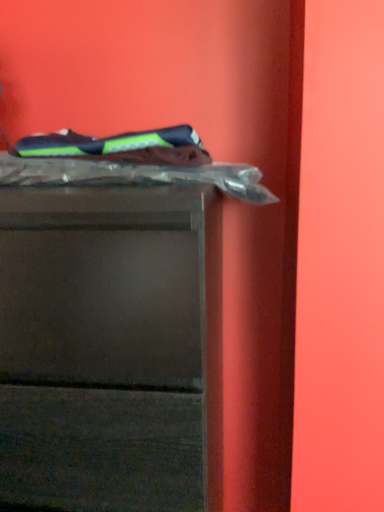
What do you see at coordinates (127, 162) in the screenshot? I see `clear plastic laundry at upper center, the 1th laundry from the bottom` at bounding box center [127, 162].

Measure the distance between matte plastic chest of drawers at upper left and camera.

They are 21.03 inches apart.

What are the coordinates of `clear plastic laundry at upper center, the 1th laundry from the bottom` in the screenshot? It's located at (127, 162).

From the image's perspective, between clear plastic laundry at upper center, the 1th laundry from the bottom, and dark blue fabric at upper left, the 2th laundry positioned from the bottom, which one is located above?

From the image's view, dark blue fabric at upper left, the 2th laundry positioned from the bottom, is above.

Considering the relative sizes of clear plastic laundry at upper center, the 1th laundry from the bottom, and dark blue fabric at upper left, which is the 1th laundry from top to bottom, in the image provided, is clear plastic laundry at upper center, the 1th laundry from the bottom, thinner than dark blue fabric at upper left, which is the 1th laundry from top to bottom,?

In fact, clear plastic laundry at upper center, the 1th laundry from the bottom, might be wider than dark blue fabric at upper left, which is the 1th laundry from top to bottom.

In the image, is clear plastic laundry at upper center, the 2th laundry from the top, on the left side or the right side of dark blue fabric at upper left, which is the 1th laundry from top to bottom?

clear plastic laundry at upper center, the 2th laundry from the top, is positioned on dark blue fabric at upper left, which is the 1th laundry from top to bottom,'s right side.

Would you consider clear plastic laundry at upper center, the 2th laundry from the top, to be distant from dark blue fabric at upper left, the 2th laundry positioned from the bottom?

No, clear plastic laundry at upper center, the 2th laundry from the top, is not far away from dark blue fabric at upper left, the 2th laundry positioned from the bottom.

From the image's perspective, does clear plastic laundry at upper center, the 2th laundry from the top, appear higher than matte plastic chest of drawers at upper left?

Yes, from the image's perspective, clear plastic laundry at upper center, the 2th laundry from the top, is above matte plastic chest of drawers at upper left.

Is clear plastic laundry at upper center, the 2th laundry from the top, at the left side of matte plastic chest of drawers at upper left?

In fact, clear plastic laundry at upper center, the 2th laundry from the top, is to the right of matte plastic chest of drawers at upper left.

The image size is (384, 512). Find the location of `the 2nd laundry to the right of the matte plastic chest of drawers at upper left, counting from the anchor's position`. the 2nd laundry to the right of the matte plastic chest of drawers at upper left, counting from the anchor's position is located at coordinates (127, 162).

Can you confirm if clear plastic laundry at upper center, the 2th laundry from the top, is taller than matte plastic chest of drawers at upper left?

No, clear plastic laundry at upper center, the 2th laundry from the top, is not taller than matte plastic chest of drawers at upper left.

Considering the points (103, 143) and (79, 177), which point is behind, point (103, 143) or point (79, 177)?

The point (103, 143) is behind.

Locate an element on the screen. The width and height of the screenshot is (384, 512). laundry above the clear plastic laundry at upper center, the 2th laundry from the top (from a real-world perspective) is located at coordinates (122, 146).

Can you confirm if dark blue fabric at upper left, the 2th laundry positioned from the bottom, is smaller than clear plastic laundry at upper center, the 1th laundry from the bottom?

Yes, dark blue fabric at upper left, the 2th laundry positioned from the bottom, is smaller than clear plastic laundry at upper center, the 1th laundry from the bottom.

From the picture: How distant is matte plastic chest of drawers at upper left from clear plastic laundry at upper center, the 1th laundry from the bottom?

The distance of matte plastic chest of drawers at upper left from clear plastic laundry at upper center, the 1th laundry from the bottom, is 9.23 inches.

Between matte plastic chest of drawers at upper left and clear plastic laundry at upper center, the 2th laundry from the top, which one has smaller size?

clear plastic laundry at upper center, the 2th laundry from the top, is smaller.

Would you say matte plastic chest of drawers at upper left is a long distance from clear plastic laundry at upper center, the 1th laundry from the bottom?

That's not correct — matte plastic chest of drawers at upper left is a little close to clear plastic laundry at upper center, the 1th laundry from the bottom.

Is matte plastic chest of drawers at upper left further to the viewer compared to clear plastic laundry at upper center, the 1th laundry from the bottom?

No, the depth of matte plastic chest of drawers at upper left is less than that of clear plastic laundry at upper center, the 1th laundry from the bottom.

Is matte plastic chest of drawers at upper left a part of dark blue fabric at upper left, which is the 1th laundry from top to bottom?

No, dark blue fabric at upper left, which is the 1th laundry from top to bottom, does not contain matte plastic chest of drawers at upper left.

From a real-world perspective, is dark blue fabric at upper left, the 2th laundry positioned from the bottom, positioned under matte plastic chest of drawers at upper left based on gravity?

Actually, dark blue fabric at upper left, the 2th laundry positioned from the bottom, is physically above matte plastic chest of drawers at upper left in the real world.

Can you confirm if dark blue fabric at upper left, which is the 1th laundry from top to bottom, is shorter than matte plastic chest of drawers at upper left?

Yes, dark blue fabric at upper left, which is the 1th laundry from top to bottom, is shorter than matte plastic chest of drawers at upper left.

What's the angular difference between matte plastic chest of drawers at upper left and dark blue fabric at upper left, which is the 1th laundry from top to bottom,'s facing directions?

The angle between the facing direction of matte plastic chest of drawers at upper left and the facing direction of dark blue fabric at upper left, which is the 1th laundry from top to bottom, is 0.00129 degrees.

From the image's perspective, is matte plastic chest of drawers at upper left above dark blue fabric at upper left, which is the 1th laundry from top to bottom?

Actually, matte plastic chest of drawers at upper left appears below dark blue fabric at upper left, which is the 1th laundry from top to bottom, in the image.

From the picture: From a real-world perspective, between matte plastic chest of drawers at upper left and dark blue fabric at upper left, which is the 1th laundry from top to bottom, who is vertically higher?

dark blue fabric at upper left, which is the 1th laundry from top to bottom, is physically above.

Does matte plastic chest of drawers at upper left turn towards dark blue fabric at upper left, the 2th laundry positioned from the bottom?

No.

Where is `laundry that is above the clear plastic laundry at upper center, the 2th laundry from the top (from a real-world perspective)`? This screenshot has width=384, height=512. laundry that is above the clear plastic laundry at upper center, the 2th laundry from the top (from a real-world perspective) is located at coordinates (122, 146).

This screenshot has width=384, height=512. Find the location of `laundry that is the 2nd object to the right of the matte plastic chest of drawers at upper left, starting at the anchor`. laundry that is the 2nd object to the right of the matte plastic chest of drawers at upper left, starting at the anchor is located at coordinates (127, 162).

Considering their positions, is matte plastic chest of drawers at upper left positioned closer to clear plastic laundry at upper center, the 1th laundry from the bottom, than dark blue fabric at upper left, which is the 1th laundry from top to bottom?

dark blue fabric at upper left, which is the 1th laundry from top to bottom, is closer to clear plastic laundry at upper center, the 1th laundry from the bottom.

Estimate the real-world distances between objects in this image. Which object is closer to clear plastic laundry at upper center, the 1th laundry from the bottom, dark blue fabric at upper left, the 2th laundry positioned from the bottom, or matte plastic chest of drawers at upper left?

The object closer to clear plastic laundry at upper center, the 1th laundry from the bottom, is dark blue fabric at upper left, the 2th laundry positioned from the bottom.

Estimate the real-world distances between objects in this image. Which object is closer to dark blue fabric at upper left, the 2th laundry positioned from the bottom, matte plastic chest of drawers at upper left or clear plastic laundry at upper center, the 1th laundry from the bottom?

The object closer to dark blue fabric at upper left, the 2th laundry positioned from the bottom, is clear plastic laundry at upper center, the 1th laundry from the bottom.

From the image, which object appears to be nearer to matte plastic chest of drawers at upper left, clear plastic laundry at upper center, the 2th laundry from the top, or dark blue fabric at upper left, the 2th laundry positioned from the bottom?

The object closer to matte plastic chest of drawers at upper left is clear plastic laundry at upper center, the 2th laundry from the top.

Which object lies further to the anchor point dark blue fabric at upper left, the 2th laundry positioned from the bottom, clear plastic laundry at upper center, the 2th laundry from the top, or matte plastic chest of drawers at upper left?

matte plastic chest of drawers at upper left is positioned further to the anchor dark blue fabric at upper left, the 2th laundry positioned from the bottom.

When comparing their distances from matte plastic chest of drawers at upper left, does dark blue fabric at upper left, which is the 1th laundry from top to bottom, or clear plastic laundry at upper center, the 1th laundry from the bottom, seem further?

Among the two, dark blue fabric at upper left, which is the 1th laundry from top to bottom, is located further to matte plastic chest of drawers at upper left.

The height and width of the screenshot is (512, 384). In order to click on laundry between dark blue fabric at upper left, the 2th laundry positioned from the bottom, and matte plastic chest of drawers at upper left vertically in this screenshot , I will do `click(127, 162)`.